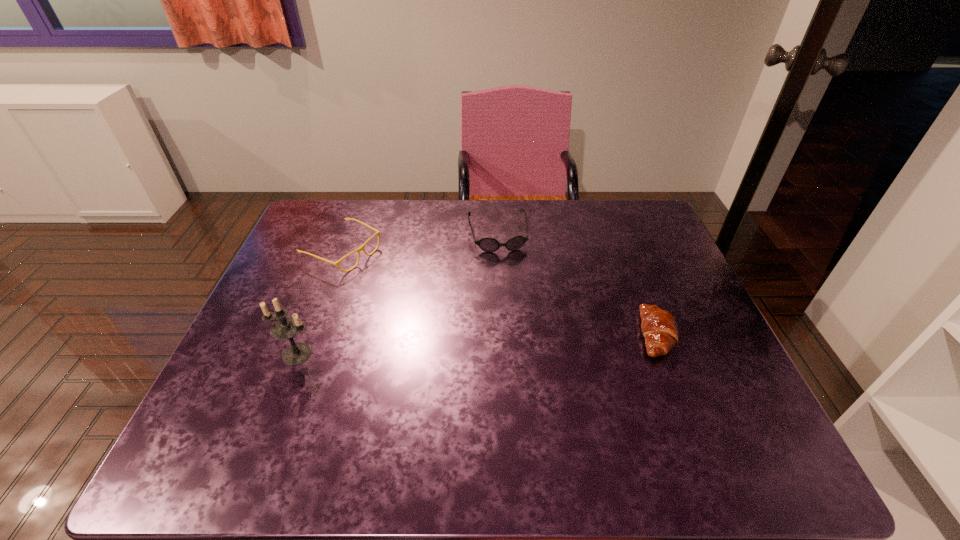
Where is `vacant space on the desktop that is between the tallest object and the rightmost object and is positioned on the lenses of the third object from left to right`? The image size is (960, 540). vacant space on the desktop that is between the tallest object and the rightmost object and is positioned on the lenses of the third object from left to right is located at coordinates (522, 341).

Where is `vacant space on the desktop that is between the candle holder and the rightmost object and is positioned in front of the lenses of the spectacles`? vacant space on the desktop that is between the candle holder and the rightmost object and is positioned in front of the lenses of the spectacles is located at coordinates (533, 341).